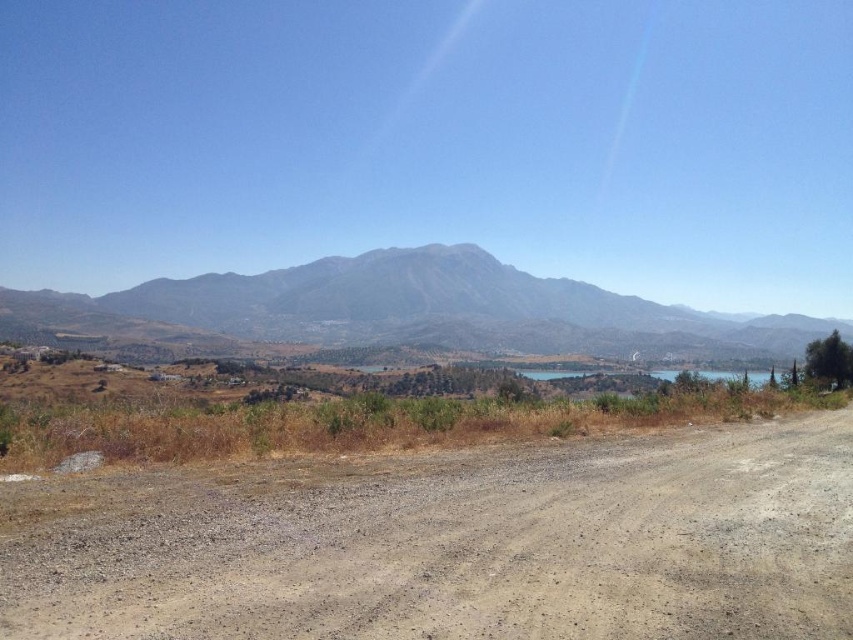
Question: Which object appears closest to the camera in this image?

Choices:
 (A) gray rocky mountain at center
 (B) brown gravel dirt track at lower left

Answer: (B)

Question: Can you confirm if brown gravel dirt track at lower left is positioned below gray rocky mountain at center?

Choices:
 (A) no
 (B) yes

Answer: (B)

Question: Which object appears farthest from the camera in this image?

Choices:
 (A) gray rocky mountain at center
 (B) brown gravel dirt track at lower left

Answer: (A)

Question: Can you confirm if brown gravel dirt track at lower left is thinner than gray rocky mountain at center?

Choices:
 (A) no
 (B) yes

Answer: (B)

Question: Does brown gravel dirt track at lower left have a larger size compared to gray rocky mountain at center?

Choices:
 (A) no
 (B) yes

Answer: (A)

Question: Which point appears closest to the camera in this image?

Choices:
 (A) (183, 308)
 (B) (837, 497)

Answer: (B)